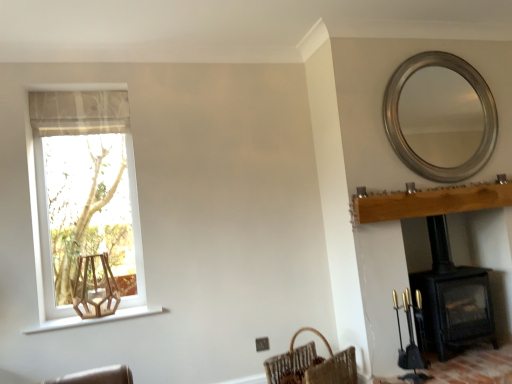
Question: In terms of size, does silver metallic mirror at upper right appear bigger or smaller than black matte wood burning stove at lower right?

Choices:
 (A) big
 (B) small

Answer: (B)

Question: From the image's perspective, relative to black matte wood burning stove at lower right, is silver metallic mirror at upper right above or below?

Choices:
 (A) above
 (B) below

Answer: (A)

Question: Based on their relative distances, which object is nearer to the light brown wood mantle at upper right?

Choices:
 (A) black matte wood burning stove at lower right
 (B) silver metallic mirror at upper right
 (C) wooden hexagonal swivel chair at lower left
 (D) brown woven basket at lower right
 (E) translucent fabric at left

Answer: (A)

Question: Considering the real-world distances, which object is farthest from the translucent fabric at left?

Choices:
 (A) wooden hexagonal swivel chair at lower left
 (B) brown woven basket at lower right
 (C) black matte wood burning stove at lower right
 (D) silver metallic mirror at upper right
 (E) light brown wood mantle at upper right

Answer: (D)